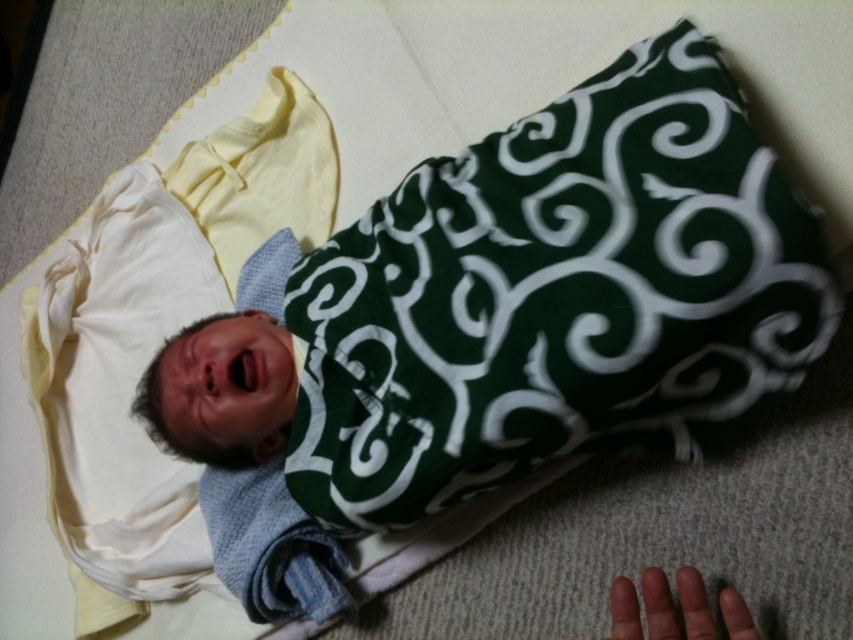
Question: In this image, where is green fabric pillow at center located relative to smooth skin hand at lower right?

Choices:
 (A) above
 (B) below

Answer: (A)

Question: Is green fabric pillow at center below smooth skin hand at lower right?

Choices:
 (A) no
 (B) yes

Answer: (A)

Question: Which point appears closest to the camera in this image?

Choices:
 (A) (677, 593)
 (B) (366, 380)

Answer: (B)

Question: Which of the following is the closest to the observer?

Choices:
 (A) (817, 284)
 (B) (648, 627)

Answer: (A)

Question: Can you confirm if green fabric pillow at center is positioned below smooth skin hand at lower right?

Choices:
 (A) yes
 (B) no

Answer: (B)

Question: Which object is closer to the camera taking this photo?

Choices:
 (A) smooth skin hand at lower right
 (B) green fabric pillow at center

Answer: (B)